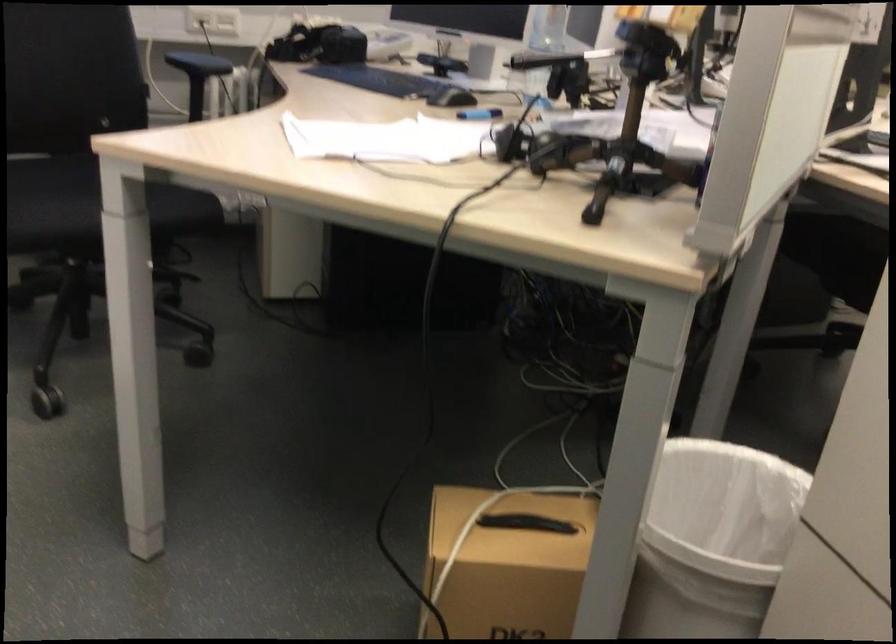
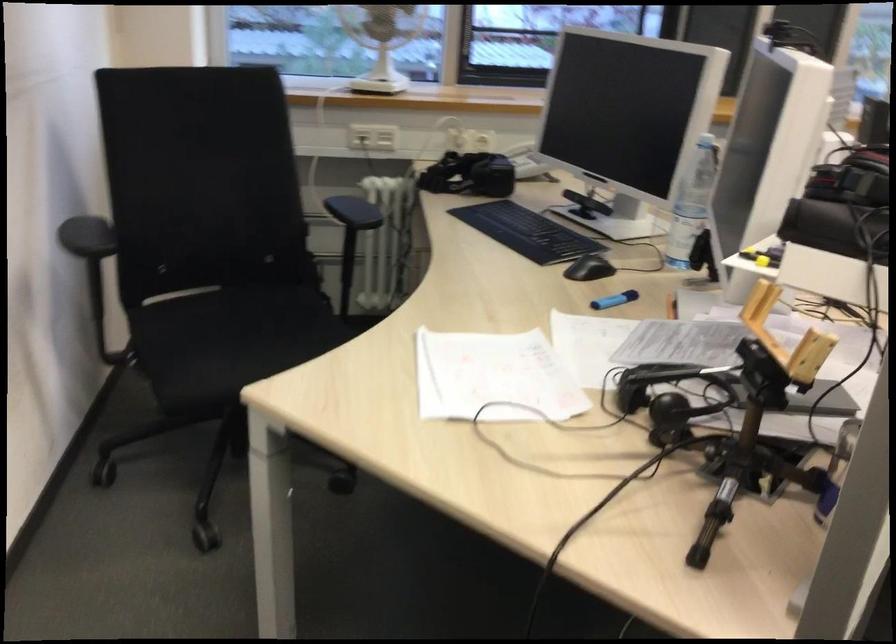
Find the pixel in the second image that matches [478,114] in the first image.

(615, 299)